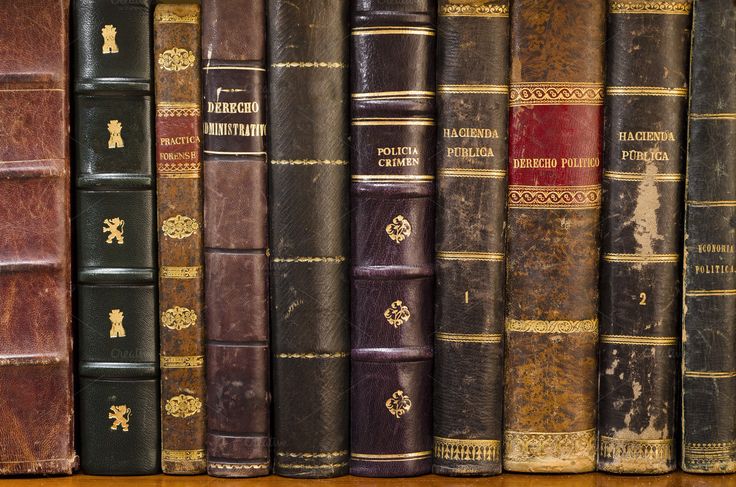
Locate an element on the screen. leather-bound books is located at coordinates (37, 272), (105, 268), (174, 265), (237, 258), (307, 266), (389, 256), (481, 276), (545, 277), (637, 278), (697, 283).